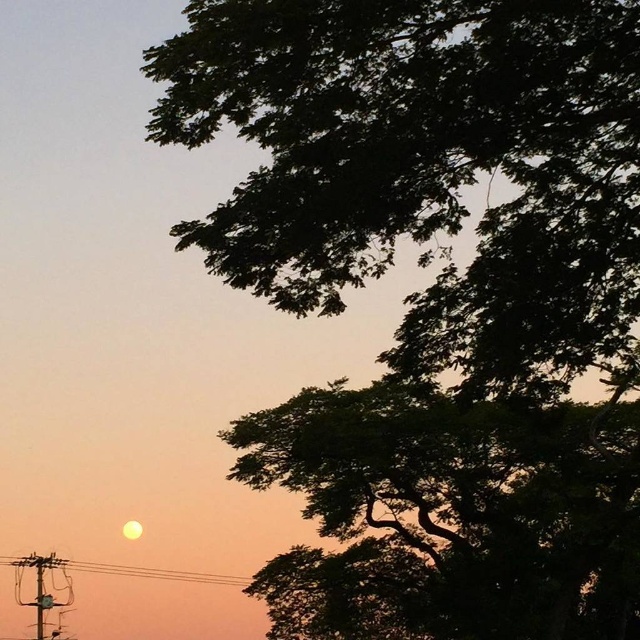
From the picture: You are standing at the center of the image and want to look at the dark green leafy tree at upper right. In which direction should you turn your head to see it?

The dark green leafy tree at upper right is located at point 0.805 on the x axis and 0.703 on the y axis. Since the coordinate system starts at the bottom left corner, the tree is to the upper right of the center. Therefore, you should turn your head to the upper right direction to see the dark green leafy tree at upper right.

You are standing in front of the sunset scene and want to touch both points, point (x=536, y=572) and point (x=4, y=563). Which point would you reach first?

Point (x=536, y=572) is closer to the camera than point (x=4, y=563), so you would reach point (x=536, y=572) first.

You are a bird flying at an altitude of 30 feet. You see the dark green leafy tree at upper right and the metallic wire at lower left. Which object is closer to your current position?

The metallic wire at lower left is closer to your current position because it is only 41.28 feet away from the dark green leafy tree at upper right, so if you are flying at 30 feet, the metallic wire at lower left would be closer as it is positioned lower in the scene.